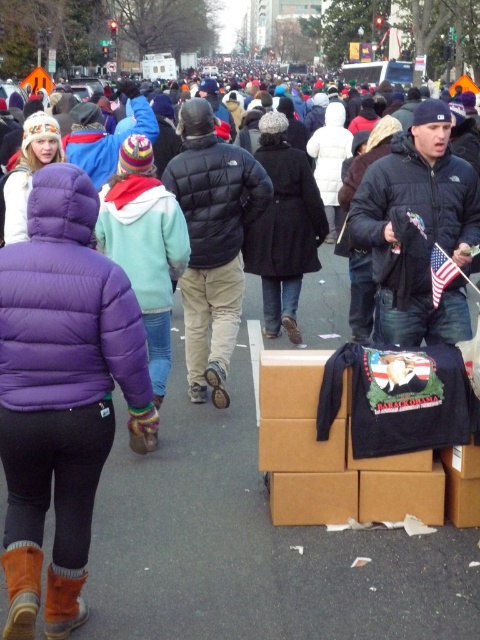
You are a photographer standing at the edge of the crowd. You want to capture a photo of the crowd while ensuring the black puffy jacket at center is in the center of the frame. Where should you position your camera to achieve this?

To center the black puffy jacket at center in the frame, position your camera so that it aligns with the coordinates specified by the 2D location point at (213,243), ensuring the jacket is at the center of your viewfinder.

You are a photographer trying to capture both the black puffy jacket at center and the american flag at center in a single frame. Given that your camera can only focus on objects within a 2 meter width, will both objects fit in the frame if they are placed side by side?

The black puffy jacket at center is bigger than the american flag at center. However, without knowing their exact dimensions, it is impossible to determine if they can fit within the 2 meter width. Additional information about their sizes is required to answer this accurately.

You are a photographer trying to capture both the purple puffy jacket at left and the black matte jacket at center in a single frame. Which jacket will appear larger in the photo?

The purple puffy jacket at left will appear larger in the photo because it is much taller than the black matte jacket at center.